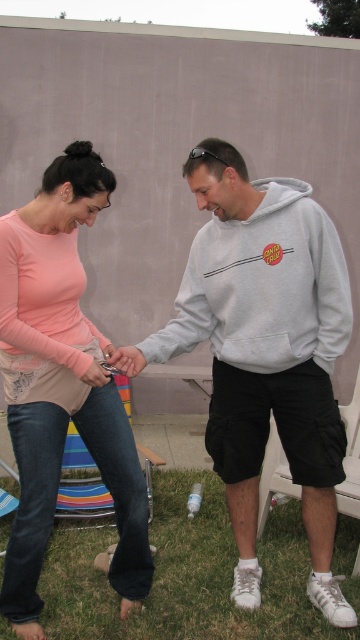
In the scene shown: You are a delivery robot with a 3.5 feet wide package. You need to move from the pink matte shirt at upper left to the white plastic chair at lower right. Can you pass through the space between them without tilting the package?

The distance between the pink matte shirt at upper left and the white plastic chair at lower right is 3.72 feet. Since the package is 3.5 feet wide, it can fit through the space as the distance is slightly larger than the package width.

You are standing in a park and see the pink matte shirt at upper left. If you want to reach it, how many steps would you need to take if each step covers 0.75 meters?

The distance between you and the pink matte shirt at upper left is 2.25 meters. Since each step covers 0.75 meters, you would need to take 3 steps to reach it.